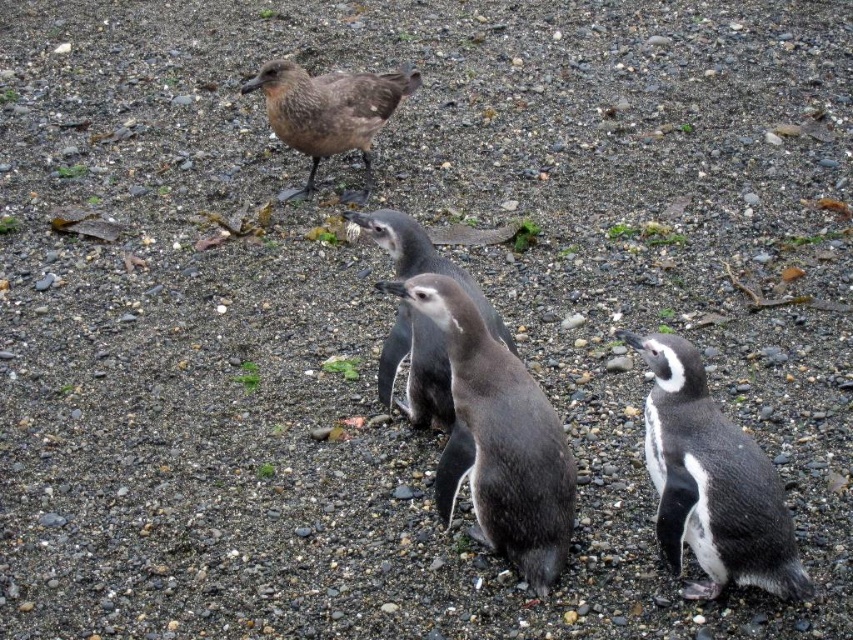
Which is more to the left, gray matte penguin at center or black glossy penguin at center?

From the viewer's perspective, black glossy penguin at center appears more on the left side.

Which of these two, gray matte penguin at center or black glossy penguin at center, stands taller?

With more height is gray matte penguin at center.

Identify the location of gray matte penguin at center. Image resolution: width=853 pixels, height=640 pixels. (498, 438).

Is gray matte penguin at center above gray matte penguin at lower right?

No.

Between gray matte penguin at center and gray matte penguin at lower right, which one is positioned higher?

Positioned higher is gray matte penguin at lower right.

Does point (503, 362) come closer to viewer compared to point (682, 477)?

No, it is not.

At what (x,y) coordinates should I click in order to perform the action: click on gray matte penguin at center. Please return your answer as a coordinate pair (x, y). The height and width of the screenshot is (640, 853). Looking at the image, I should click on (498, 438).

Which is in front, point (563, 548) or point (375, 131)?

Positioned in front is point (563, 548).

Which is more to the left, gray matte penguin at center or brown feathered bird at upper center?

brown feathered bird at upper center

This screenshot has width=853, height=640. In order to click on gray matte penguin at center in this screenshot , I will do `click(498, 438)`.

Locate an element on the screen. This screenshot has height=640, width=853. gray matte penguin at center is located at coordinates (498, 438).